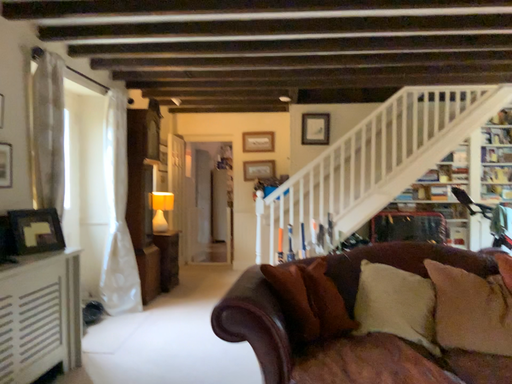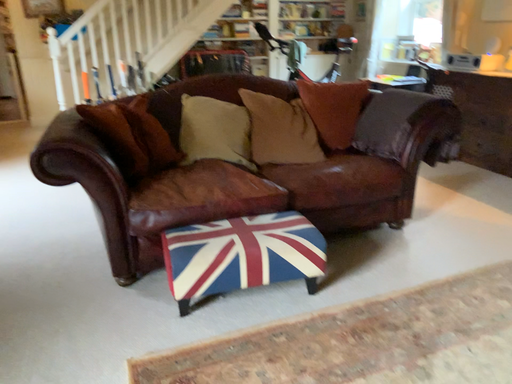
Question: Which way did the camera rotate in the video?

Choices:
 (A) rotated downward
 (B) rotated upward

Answer: (A)